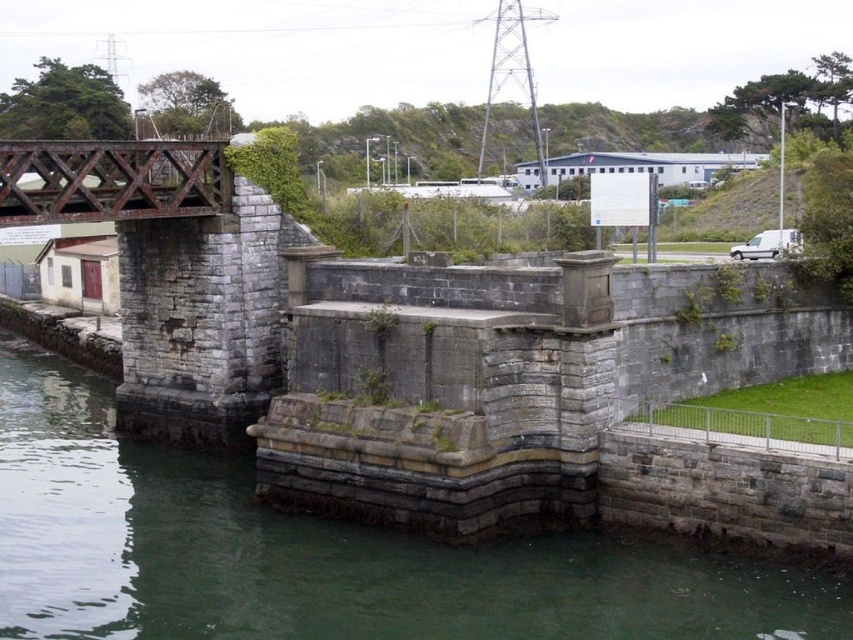
How far apart are gray stone wall at lower left and rusty metal bridge at upper left?

gray stone wall at lower left is 33.43 feet from rusty metal bridge at upper left.

What do you see at coordinates (318, 554) in the screenshot? I see `gray stone wall at lower left` at bounding box center [318, 554].

Describe the element at coordinates (318, 554) in the screenshot. I see `gray stone wall at lower left` at that location.

This screenshot has height=640, width=853. I want to click on gray stone wall at lower left, so click(318, 554).